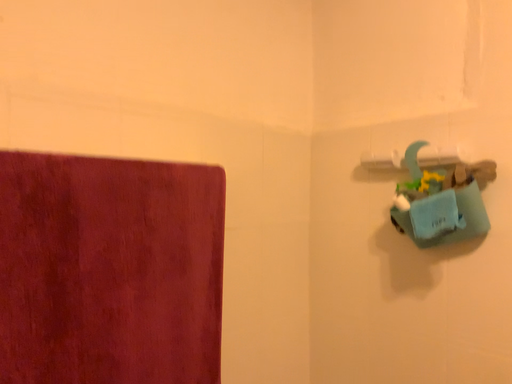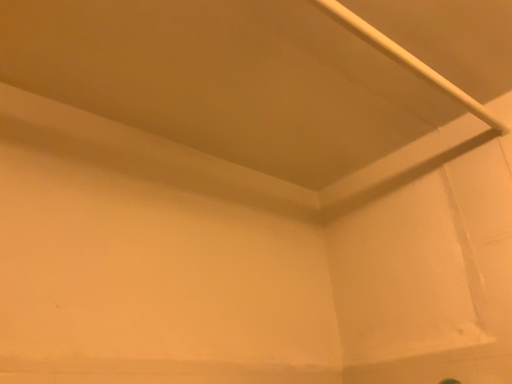
Question: How did the camera likely rotate when shooting the video?

Choices:
 (A) rotated upward
 (B) rotated downward

Answer: (A)